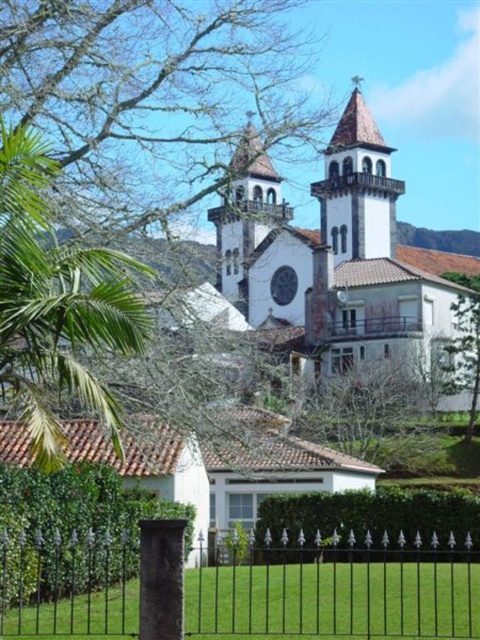
Who is taller, white stucco church at center or green leafy hedge at lower left?

Standing taller between the two is white stucco church at center.

Identify the location of white stucco church at center. This screenshot has height=640, width=480. (336, 253).

Is green leafy hedge at lower left taller than green leafy hedge at lower center?

Correct, green leafy hedge at lower left is much taller as green leafy hedge at lower center.

Does green leafy hedge at lower left have a larger size compared to green leafy hedge at lower center?

Incorrect, green leafy hedge at lower left is not larger than green leafy hedge at lower center.

Between point (58, 477) and point (358, 532), which one is positioned behind?

The point (358, 532) is behind.

Find the location of a particular element. The image size is (480, 640). green leafy hedge at lower left is located at coordinates (72, 531).

Who is lower down, white stucco church at center or black wrought iron fence at lower center?

black wrought iron fence at lower center is lower down.

Can you confirm if white stucco church at center is bigger than black wrought iron fence at lower center?

Correct, white stucco church at center is larger in size than black wrought iron fence at lower center.

What do you see at coordinates (336, 253) in the screenshot? I see `white stucco church at center` at bounding box center [336, 253].

Where is `white stucco church at center`? This screenshot has height=640, width=480. white stucco church at center is located at coordinates (336, 253).